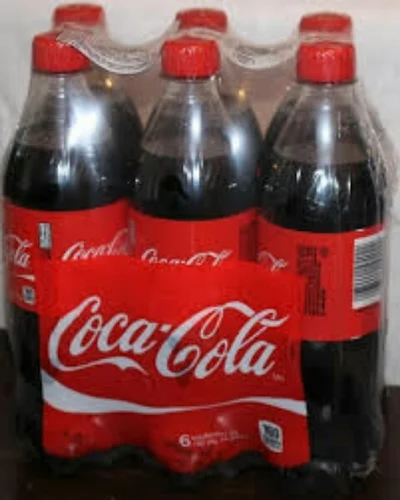
What are the coordinates of `bottles` in the screenshot? It's located at (79, 93), (195, 158), (301, 179).